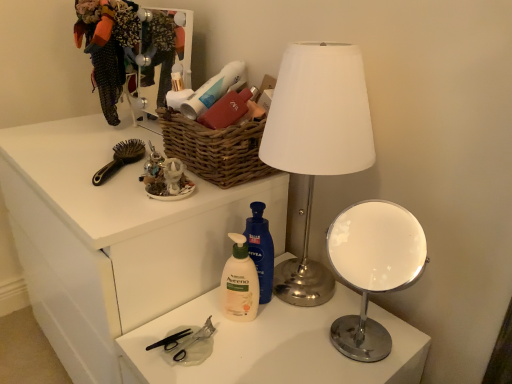
This screenshot has height=384, width=512. I want to click on free point in front of white plastic pump bottle at center, the first cleaning product viewed from the right, so click(x=267, y=354).